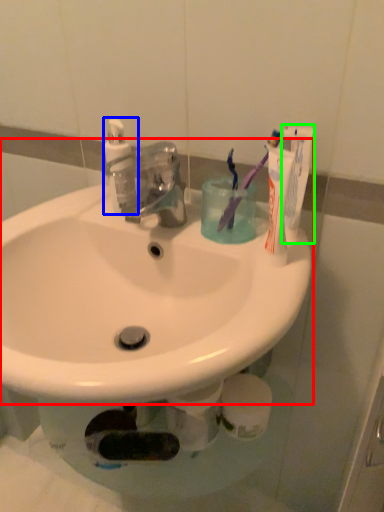
Question: Which object is positioned closest to sink (highlighted by a red box)? Select from soap dispenser (highlighted by a blue box) and toothpaste (highlighted by a green box).

Choices:
 (A) soap dispenser
 (B) toothpaste

Answer: (A)